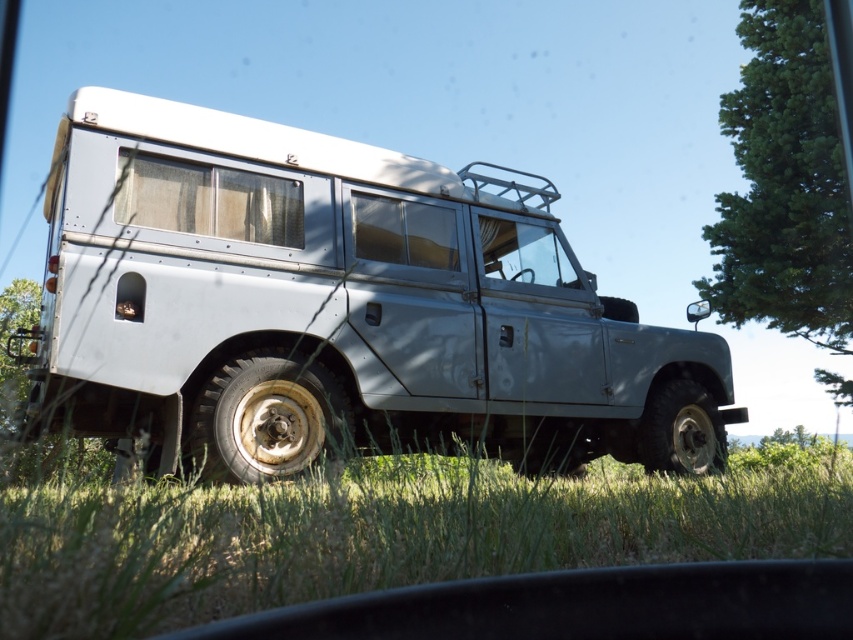
Based on the photo, does silver metallic suv at center appear on the right side of green leafy tree at upper right?

Incorrect, silver metallic suv at center is not on the right side of green leafy tree at upper right.

At what (x,y) coordinates should I click in order to perform the action: click on silver metallic suv at center. Please return your answer as a coordinate pair (x, y). The height and width of the screenshot is (640, 853). Looking at the image, I should click on (335, 308).

Locate an element on the screen. silver metallic suv at center is located at coordinates (335, 308).